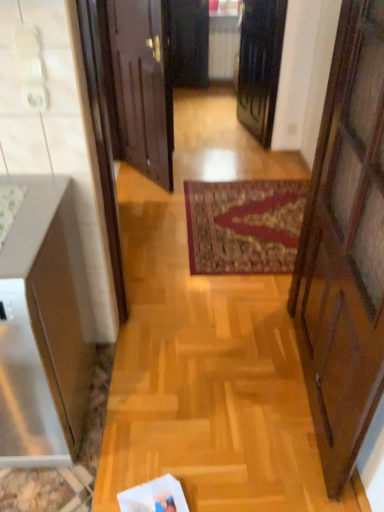
Question: From the image's perspective, is black glossy door at center, which ranks as the second door in left-to-right order, beneath wooden door at center, acting as the 2th door starting from the right?

Choices:
 (A) yes
 (B) no

Answer: (B)

Question: Does black glossy door at center, which ranks as the second door in left-to-right order, have a greater height compared to wooden door at center, the 1th door when ordered from left to right?

Choices:
 (A) yes
 (B) no

Answer: (B)

Question: From a real-world perspective, is black glossy door at center, which ranks as the second door in left-to-right order, physically below wooden door at center, acting as the 2th door starting from the right?

Choices:
 (A) no
 (B) yes

Answer: (B)

Question: Is black glossy door at center, the first door from the right, far from wooden door at center, acting as the 2th door starting from the right?

Choices:
 (A) no
 (B) yes

Answer: (B)

Question: Considering the relative sizes of black glossy door at center, the first door from the right, and wooden door at center, acting as the 2th door starting from the right, in the image provided, is black glossy door at center, the first door from the right, smaller than wooden door at center, acting as the 2th door starting from the right,?

Choices:
 (A) no
 (B) yes

Answer: (A)

Question: Is black glossy door at center, the first door from the right, surrounding wooden door at center, the 1th door when ordered from left to right?

Choices:
 (A) no
 (B) yes

Answer: (A)

Question: Is wooden door at center, the 1th door when ordered from left to right, positioned before matte white cabinet at left?

Choices:
 (A) yes
 (B) no

Answer: (B)

Question: Considering the relative sizes of wooden door at center, acting as the 2th door starting from the right, and matte white cabinet at left in the image provided, is wooden door at center, acting as the 2th door starting from the right, smaller than matte white cabinet at left?

Choices:
 (A) yes
 (B) no

Answer: (A)

Question: Can you confirm if wooden door at center, the 1th door when ordered from left to right, is bigger than matte white cabinet at left?

Choices:
 (A) yes
 (B) no

Answer: (B)

Question: Is matte white cabinet at left at the back of wooden door at center, the 1th door when ordered from left to right?

Choices:
 (A) no
 (B) yes

Answer: (A)

Question: Is wooden door at center, acting as the 2th door starting from the right, beside matte white cabinet at left?

Choices:
 (A) no
 (B) yes

Answer: (A)

Question: Does wooden door at center, acting as the 2th door starting from the right, have a greater height compared to matte white cabinet at left?

Choices:
 (A) no
 (B) yes

Answer: (B)

Question: Can you confirm if matte white cabinet at left is positioned to the right of wooden door at center, acting as the 2th door starting from the right?

Choices:
 (A) no
 (B) yes

Answer: (A)